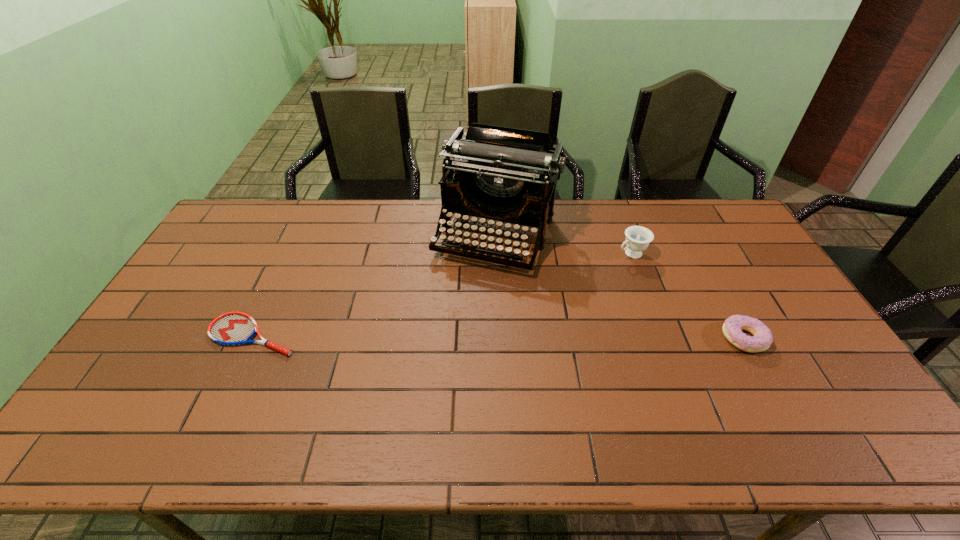
I want to click on vacant area between the doughnut and the tallest object, so click(621, 287).

At what (x,y) coordinates should I click in order to perform the action: click on vacant space that's between the tennis racket and the teacup. Please return your answer as a coordinate pair (x, y). Looking at the image, I should click on (443, 294).

I want to click on vacant area that lies between the third shortest object and the tallest object, so click(564, 244).

Identify which object is located as the nearest to the doughnut. Please provide its 2D coordinates. Your answer should be formatted as a tuple, i.e. [(x, y)], where the tuple contains the x and y coordinates of a point satisfying the conditions above.

[(638, 238)]

Where is `object that stands as the closest to the second object from left to right`? The width and height of the screenshot is (960, 540). object that stands as the closest to the second object from left to right is located at coordinates (638, 238).

I want to click on vacant space that satisfies the following two spatial constraints: 1. on the back side of the teacup; 2. on the right side of the tennis racket, so click(292, 253).

The image size is (960, 540). Identify the location of free space in the image that satisfies the following two spatial constraints: 1. on the back side of the third object from right to left; 2. on the right side of the shortest object. (300, 235).